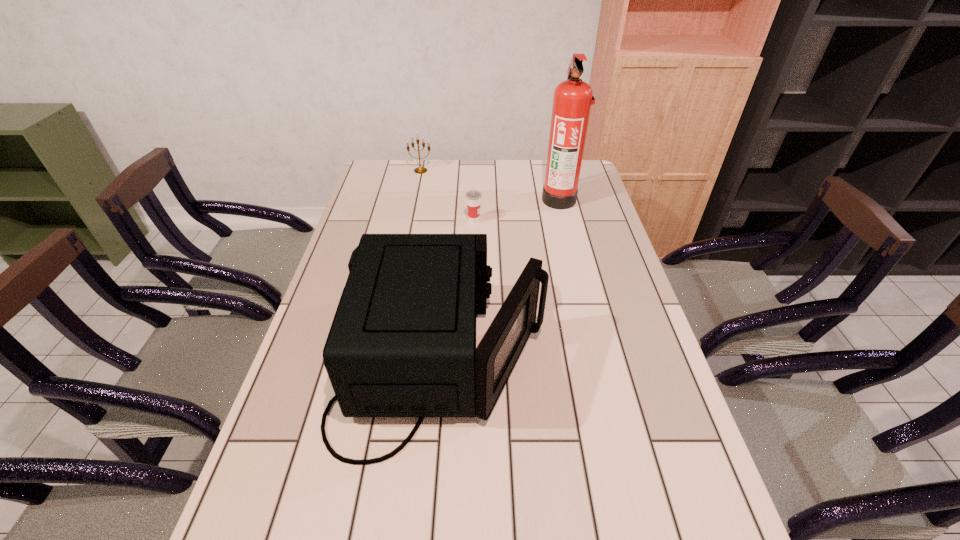
Where is `fire extinguisher`? The width and height of the screenshot is (960, 540). fire extinguisher is located at coordinates (572, 101).

I want to click on the second farthest object, so click(x=572, y=101).

Find the location of a particular element. microwave oven is located at coordinates (402, 343).

Find the location of a particular element. The image size is (960, 540). the nearest object is located at coordinates (402, 343).

Locate an element on the screen. This screenshot has height=540, width=960. the farthest object is located at coordinates (419, 170).

Identify the location of the second nearest object. This screenshot has height=540, width=960. (473, 197).

Find the location of a particular element. The width and height of the screenshot is (960, 540). cup is located at coordinates (473, 197).

Locate an element on the screen. free space located with the nozzle pointing from the back of the fire extinguisher is located at coordinates (484, 199).

In order to click on vacant region located with the nozzle pointing from the back of the fire extinguisher in this screenshot , I will do `click(445, 199)`.

This screenshot has width=960, height=540. I want to click on vacant space located 0.110m with the nozzle pointing from the back of the fire extinguisher, so click(512, 199).